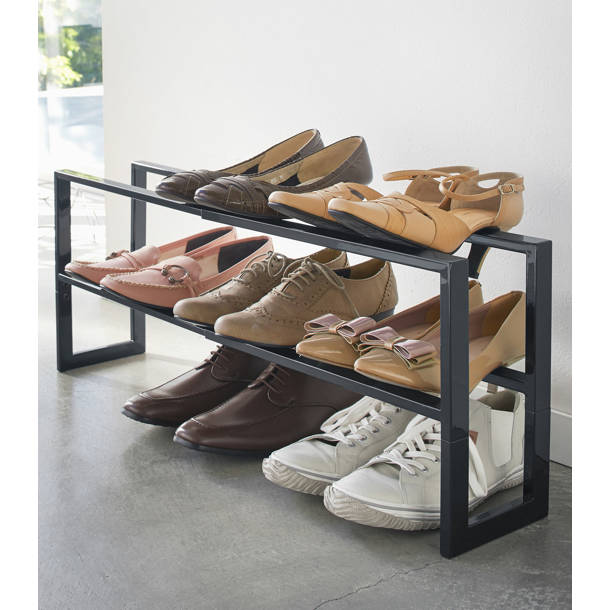
Where is `shoes on top shelf of shoe rack`? This screenshot has width=610, height=610. shoes on top shelf of shoe rack is located at coordinates (191, 181), (242, 191), (288, 199), (398, 210).